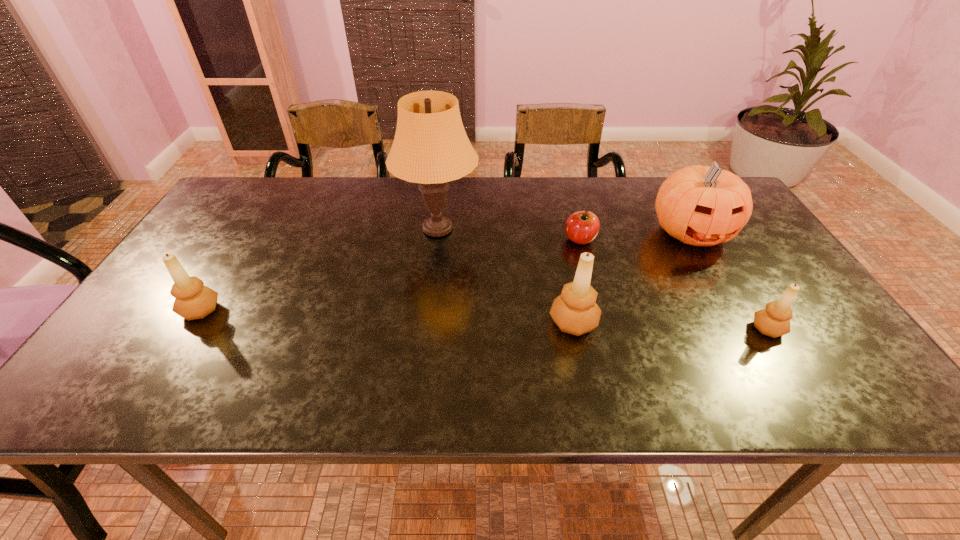
To achieve uniform spacing by inserting another candle_holder among them, please point to a free space for this new candle_holder. Please provide its 2D coordinates. Your answer should be formatted as a tuple, i.e. [(x, y)], where the tuple contains the x and y coordinates of a point satisfying the conditions above.

[(385, 316)]